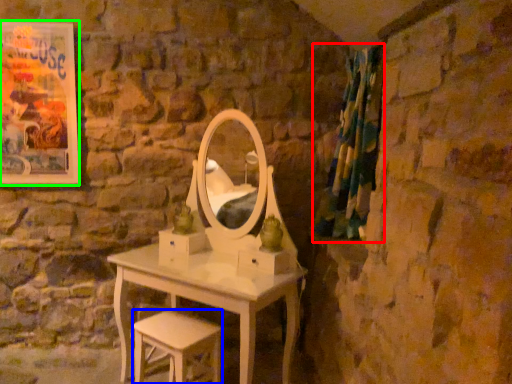
Question: Estimate the real-world distances between objects in this image. Which object is closer to curtain (highlighted by a red box), stool (highlighted by a blue box) or picture frame (highlighted by a green box)?

Choices:
 (A) stool
 (B) picture frame

Answer: (A)